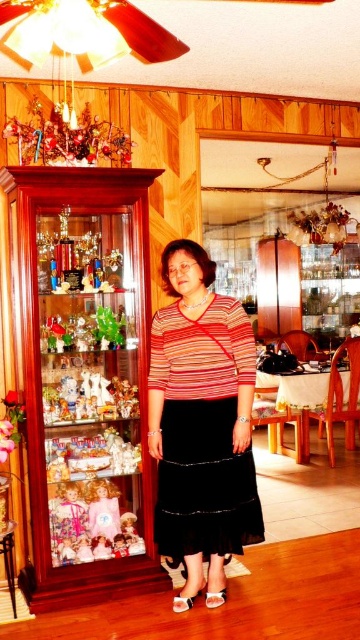
Who is shorter, striped fabric shirt at center or matte plastic doll at center?

With less height is matte plastic doll at center.

Does point (213, 534) lie in front of point (132, 392)?

Yes.

Locate an element on the screen. striped fabric shirt at center is located at coordinates (201, 422).

Find the location of a particular element. striped fabric shirt at center is located at coordinates (201, 422).

In the scene shown: Does matte plastic doll at center appear on the right side of translucent glass figurine at left?

Yes, matte plastic doll at center is to the right of translucent glass figurine at left.

Who is more distant from viewer, (83, 381) or (105, 324)?

Positioned behind is point (83, 381).

At what (x,y) coordinates should I click in order to perform the action: click on matte plastic doll at center. Please return your answer as a coordinate pair (x, y). The height and width of the screenshot is (640, 360). Looking at the image, I should click on (88, 397).

Does striped fabric shirt at center appear over pastel pink fabric doll at center?

Indeed, striped fabric shirt at center is positioned over pastel pink fabric doll at center.

Between point (201, 360) and point (109, 509), which one is positioned in front?

Point (201, 360) is in front.

At what (x,y) coordinates should I click in order to perform the action: click on striped fabric shirt at center. Please return your answer as a coordinate pair (x, y). Looking at the image, I should click on (201, 422).